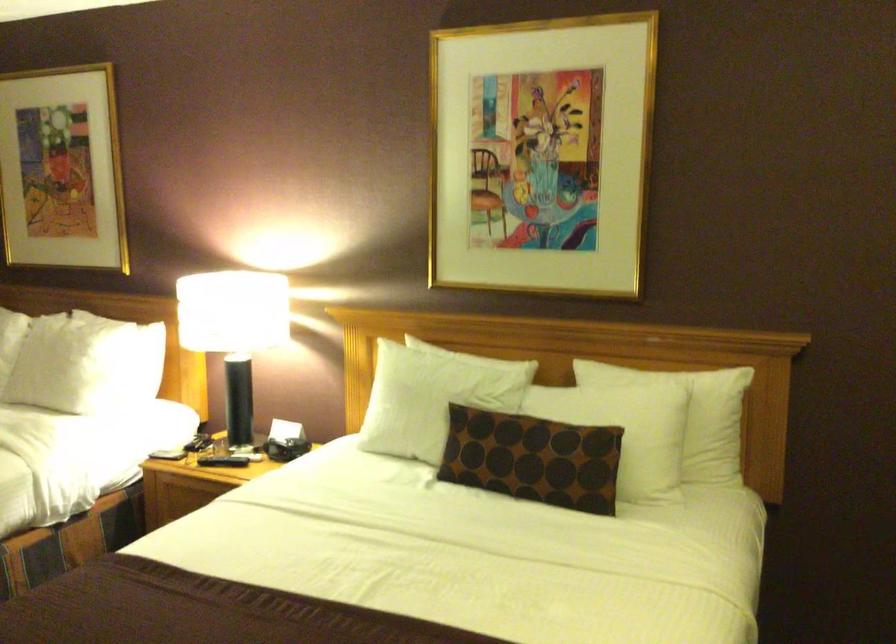
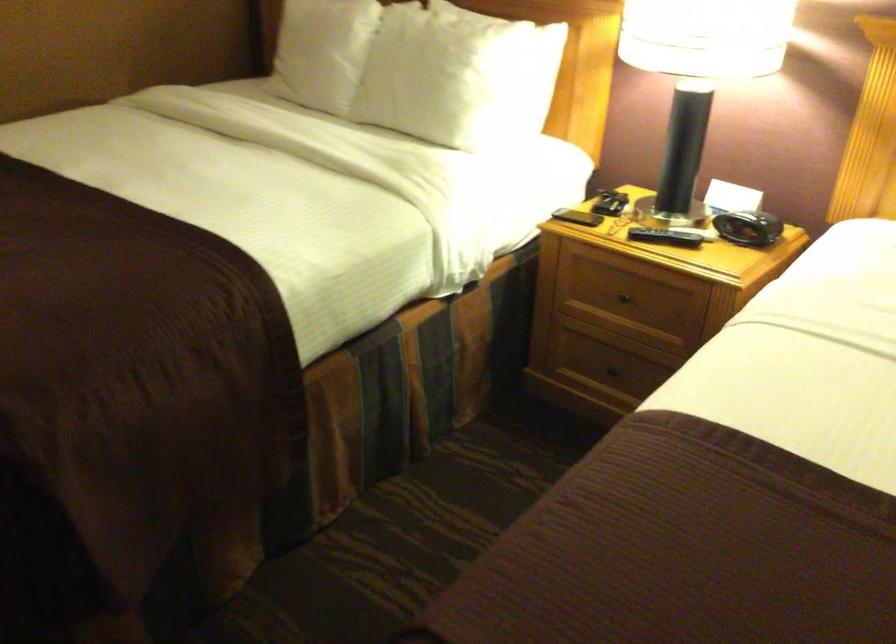
Which direction would the cameraman need to move to produce the second image?

The cameraman walked toward left, forward.